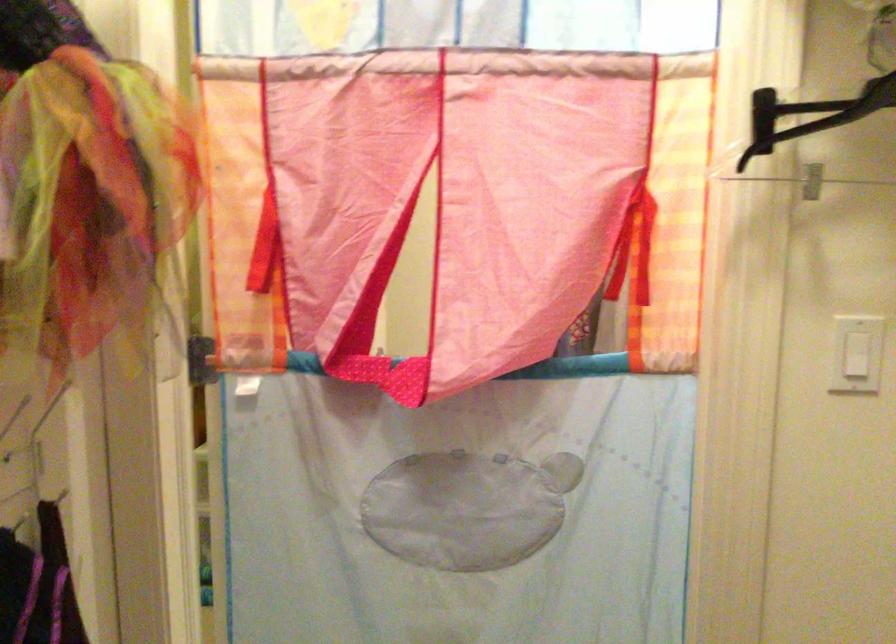
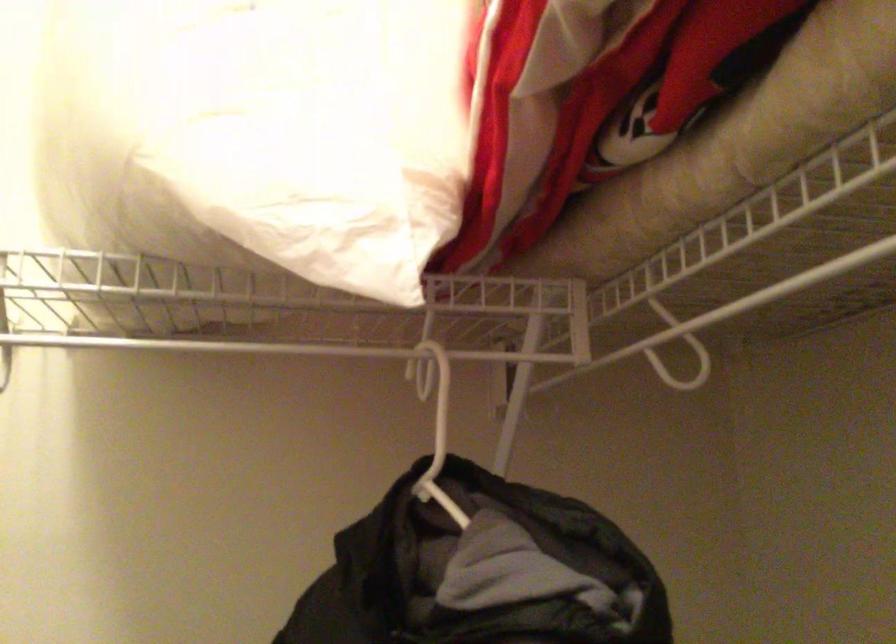
Question: The camera is either moving clockwise (left) or counter-clockwise (right) around the object. The first image is from the beginning of the video and the second image is from the end. Is the camera moving left or right when shooting the video?

Choices:
 (A) Left
 (B) Right

Answer: (A)